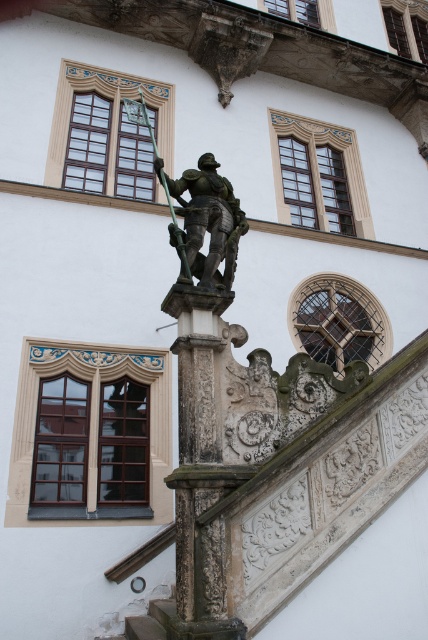
You are a tour guide leading a group to a historic building. You want to ensure that the group can walk between the carved stone pillar at center and the shiny bronze knight at center without any issues. What is the minimum width of the path between them required for a standard wheelchair to pass comfortably?

The distance between the carved stone pillar at center and the shiny bronze knight at center is 16.66 feet. A standard wheelchair requires a minimum of 3 feet of width to pass comfortably, so the path is more than sufficient.

You are standing in front of the historic building and want to take a photo of both the carved stone pillar at center and the shiny bronze knight at center. Which object should you position to your left to include both in the frame?

You should position the shiny bronze knight at center to your left since the carved stone pillar at center is to the right of it, ensuring both are included in the photo frame.